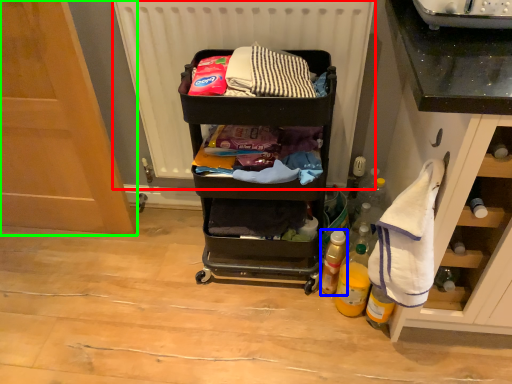
Question: Estimate the real-world distances between objects in this image. Which object is closer to radiator (highlighted by a red box), bottle (highlighted by a blue box) or door (highlighted by a green box)?

Choices:
 (A) bottle
 (B) door

Answer: (B)